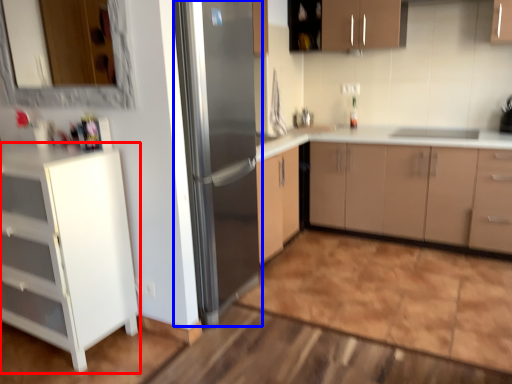
Question: Which of the following is the farthest to the observer, cabinetry (highlighted by a red box) or refrigerator (highlighted by a blue box)?

Choices:
 (A) cabinetry
 (B) refrigerator

Answer: (B)